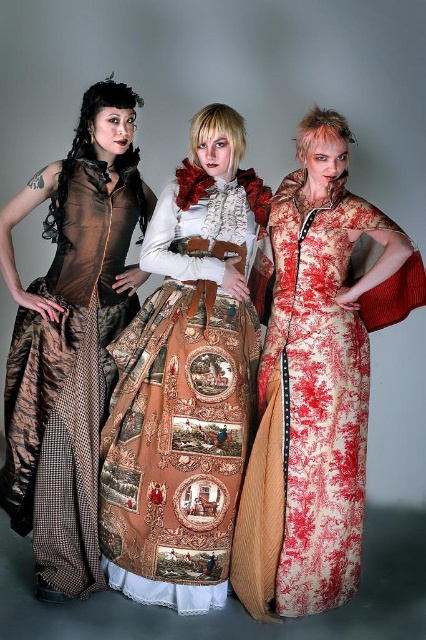
Based on the photo, is brown textured skirt at center to the right of red toile dress at center from the viewer's perspective?

No, brown textured skirt at center is not to the right of red toile dress at center.

Who is more distant from viewer, (238, 317) or (362, 499)?

The point (362, 499) is more distant.

Does point (181, 531) come farther from viewer compared to point (311, 320)?

That is False.

The image size is (426, 640). In order to click on brown textured skirt at center in this screenshot , I will do pos(186,381).

Who is higher up, red toile dress at center or matte brown dress at left?

Positioned higher is matte brown dress at left.

Is red toile dress at center shorter than matte brown dress at left?

Indeed, red toile dress at center has a lesser height compared to matte brown dress at left.

Between point (245, 564) and point (112, 257), which one is positioned behind?

The point (112, 257) is behind.

This screenshot has height=640, width=426. I want to click on red toile dress at center, so click(x=316, y=381).

Can you confirm if brown textured skirt at center is taller than matte brown dress at left?

In fact, brown textured skirt at center may be shorter than matte brown dress at left.

You are a GUI agent. You are given a task and a screenshot of the screen. Output one action in this format:
    pyautogui.click(x=<x>, y=<y>)
    Task: Click on the brown textured skirt at center
    
    Given the screenshot: What is the action you would take?
    pyautogui.click(x=186, y=381)